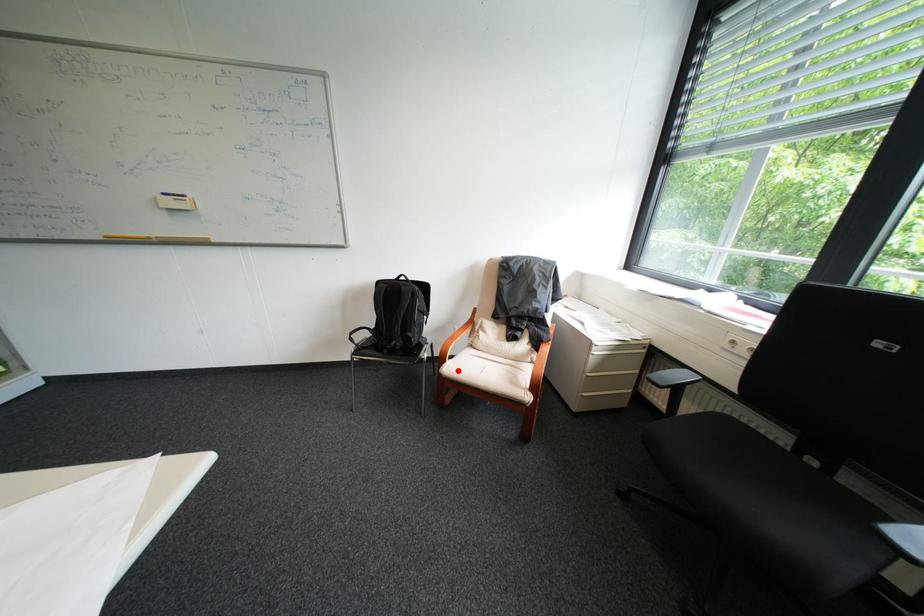
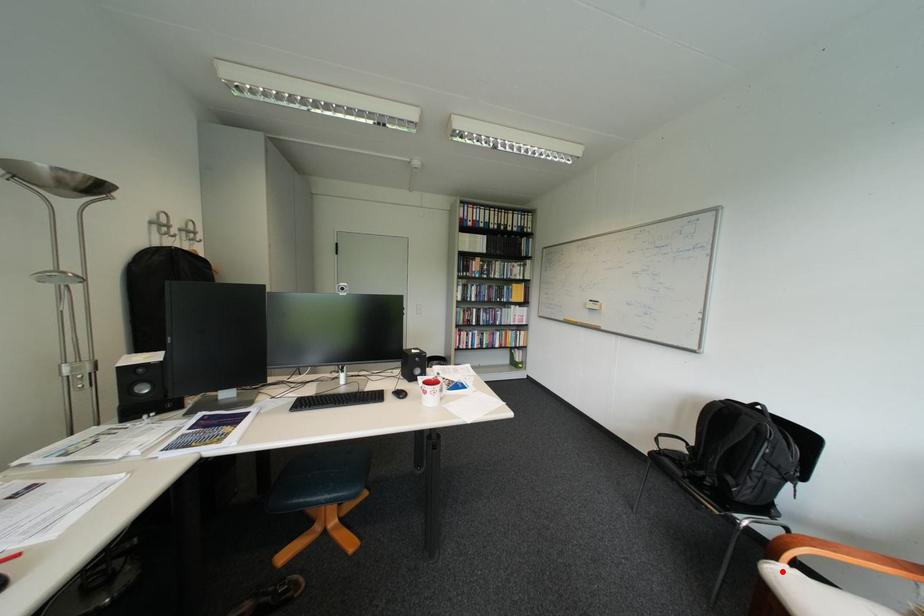
I am providing you with two images of the same scene from different viewpoints. A red point is marked on the first image and another point is marked on the second image. Is the marked point in image1 the same physical position as the marked point in image2?

Yes